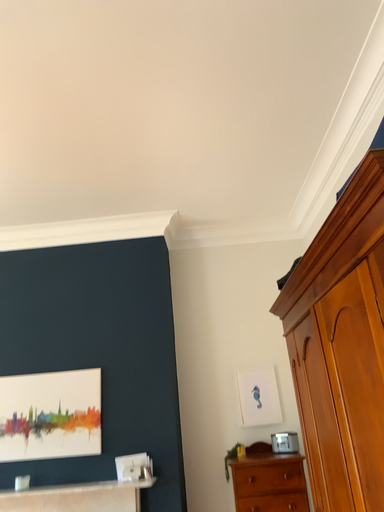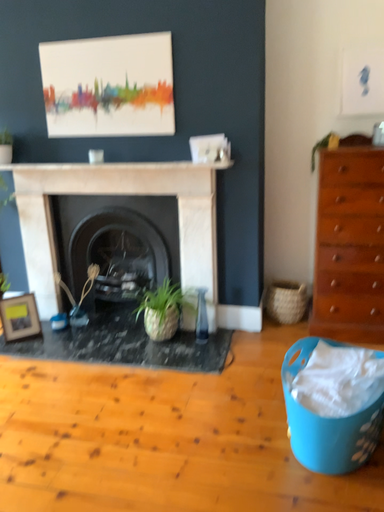
Question: Which way did the camera rotate in the video?

Choices:
 (A) rotated left
 (B) rotated right

Answer: (A)